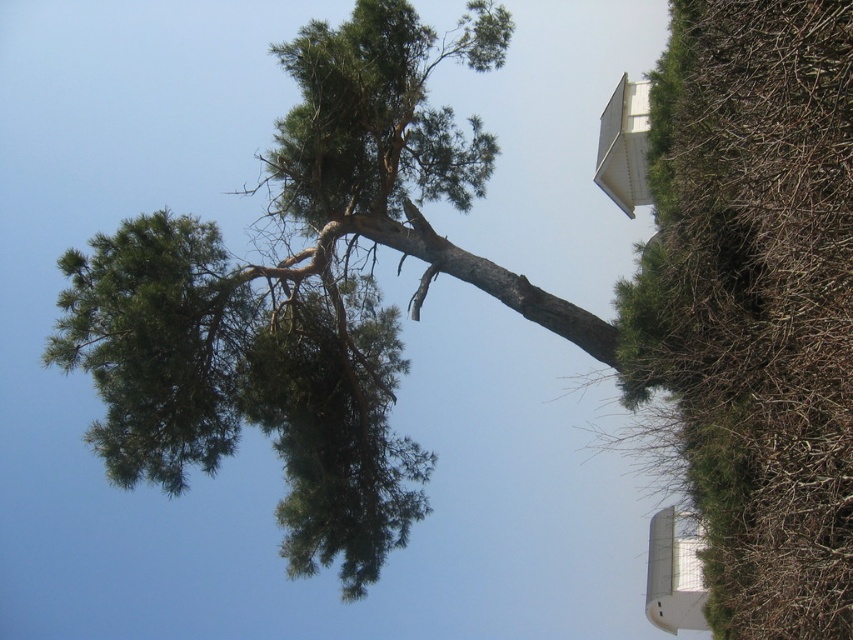
Question: Can you confirm if green rough bark tree at upper left is positioned above green needle-like at upper left?

Choices:
 (A) no
 (B) yes

Answer: (B)

Question: Which point appears farthest from the camera in this image?

Choices:
 (A) (308, 556)
 (B) (294, 116)

Answer: (A)

Question: Which object is closer to the camera taking this photo?

Choices:
 (A) green needle-like at upper left
 (B) green rough bark tree at upper left

Answer: (A)

Question: Is green rough bark tree at upper left above green needle-like at upper left?

Choices:
 (A) yes
 (B) no

Answer: (A)

Question: Does green rough bark tree at upper left appear on the left side of green needle-like at upper left?

Choices:
 (A) yes
 (B) no

Answer: (B)